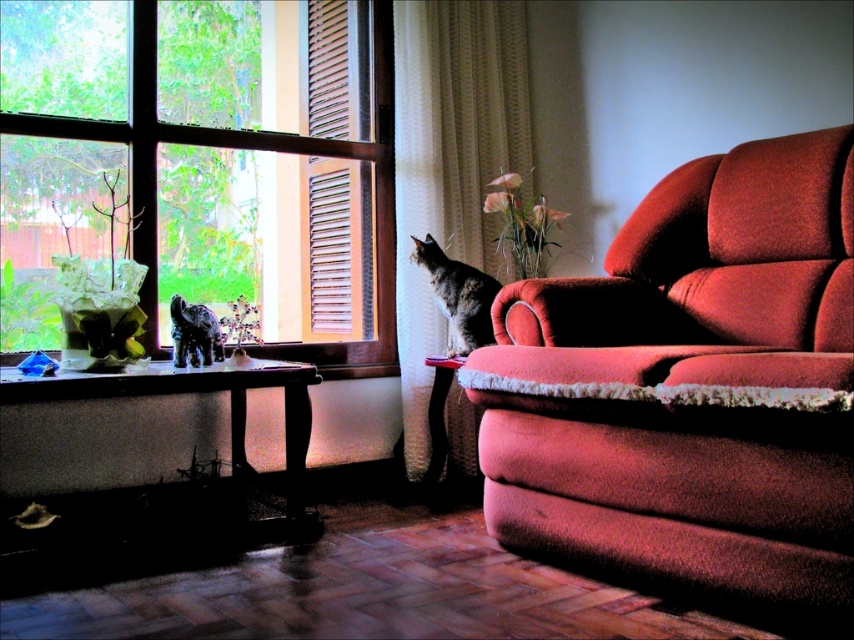
Can you confirm if wooden frame window at left is bigger than tabby fur cat at center?

Indeed, wooden frame window at left has a larger size compared to tabby fur cat at center.

Between wooden frame window at left and tabby fur cat at center, which one has more height?

Standing taller between the two is wooden frame window at left.

Image resolution: width=854 pixels, height=640 pixels. Find the location of `wooden frame window at left`. wooden frame window at left is located at coordinates (250, 148).

Find the location of a particular element. wooden frame window at left is located at coordinates (250, 148).

Is white textured curtain at center positioned behind wooden table at lower left?

Yes, it is.

Is white textured curtain at center above wooden table at lower left?

Correct, white textured curtain at center is located above wooden table at lower left.

Image resolution: width=854 pixels, height=640 pixels. What are the coordinates of `white textured curtain at center` in the screenshot? It's located at (449, 164).

Is point (430, 170) closer to camera compared to point (411, 259)?

No, (430, 170) is further to viewer.

Where is `white textured curtain at center`? white textured curtain at center is located at coordinates (449, 164).